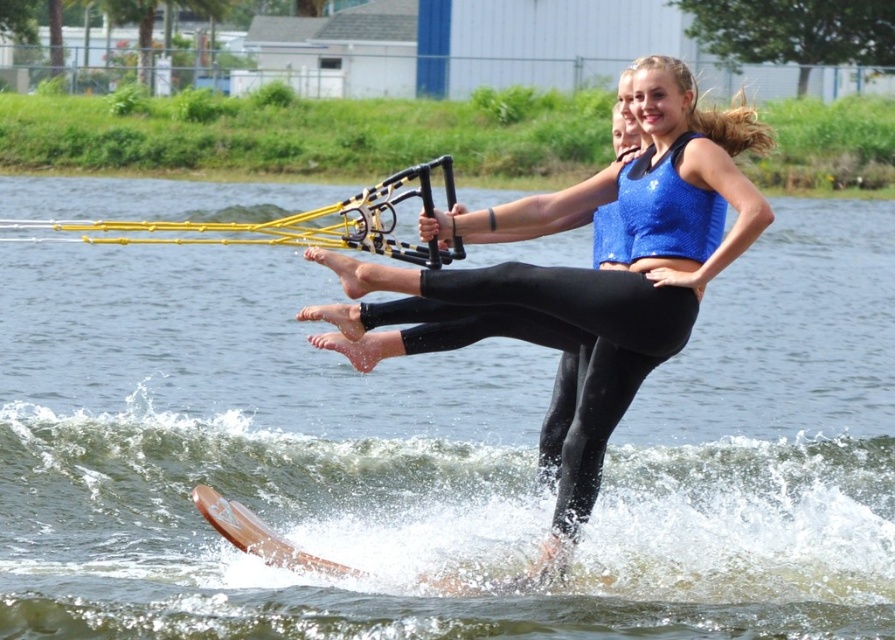
Question: Which point appears closest to the camera in this image?

Choices:
 (A) (321, 570)
 (B) (858, 620)

Answer: (A)

Question: Is brown wooden water ski at center below shiny blue tank top at center?

Choices:
 (A) yes
 (B) no

Answer: (A)

Question: Is brown wooden water ski at center smaller than wooden water ski at lower center?

Choices:
 (A) no
 (B) yes

Answer: (A)

Question: Which object appears closest to the camera in this image?

Choices:
 (A) shiny blue tank top at center
 (B) brown wooden water ski at center
 (C) wooden water ski at lower center

Answer: (C)

Question: Does brown wooden water ski at center appear over wooden water ski at lower center?

Choices:
 (A) yes
 (B) no

Answer: (A)

Question: Which point appears closest to the camera in this image?

Choices:
 (A) click(254, 317)
 (B) click(661, 360)

Answer: (B)